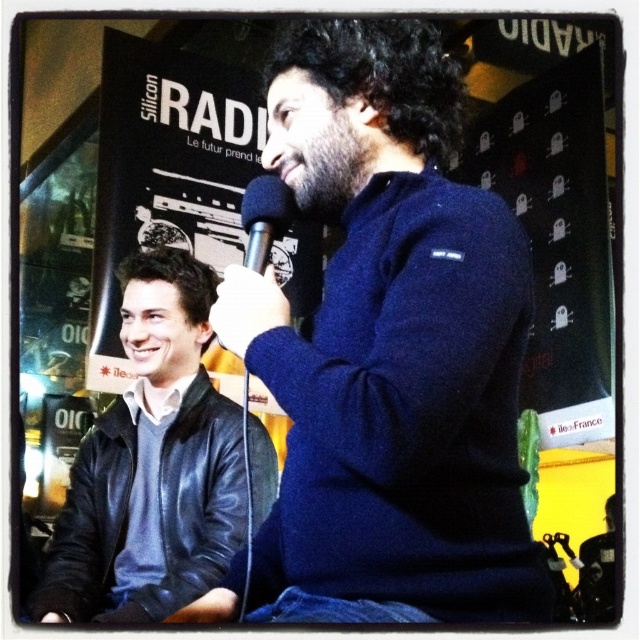
Does leather jacket at left have a smaller size compared to black metallic microphone at center?

No, leather jacket at left is not smaller than black metallic microphone at center.

Describe the element at coordinates (150, 465) in the screenshot. I see `leather jacket at left` at that location.

Find the location of a particular element. leather jacket at left is located at coordinates (150, 465).

Is dark blue sweater at center below dark brown fuzzy beard at center?

Correct, dark blue sweater at center is located below dark brown fuzzy beard at center.

Does dark blue sweater at center have a lesser height compared to dark brown fuzzy beard at center?

In fact, dark blue sweater at center may be taller than dark brown fuzzy beard at center.

Does point (445, 266) lie behind point (328, 184)?

No, it is in front of (328, 184).

In order to click on dark blue sweater at center in this screenshot , I will do `click(392, 356)`.

Which is more to the right, dark blue sweater at center or black metallic microphone at center?

dark blue sweater at center is more to the right.

At what (x,y) coordinates should I click in order to perform the action: click on dark blue sweater at center. Please return your answer as a coordinate pair (x, y). Looking at the image, I should click on (392, 356).

What are the coordinates of `dark blue sweater at center` in the screenshot? It's located at (392, 356).